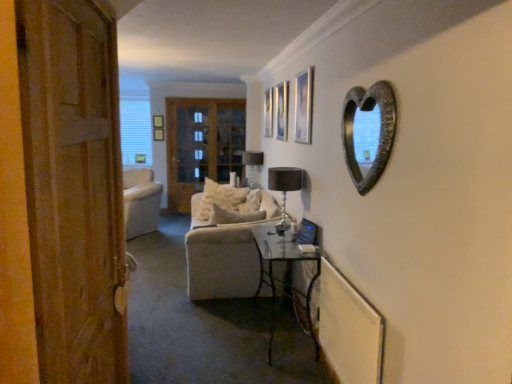
Identify the location of vacant area on top of rustic wood heart-shaped mirror at upper right (from a real-world perspective). (371, 78).